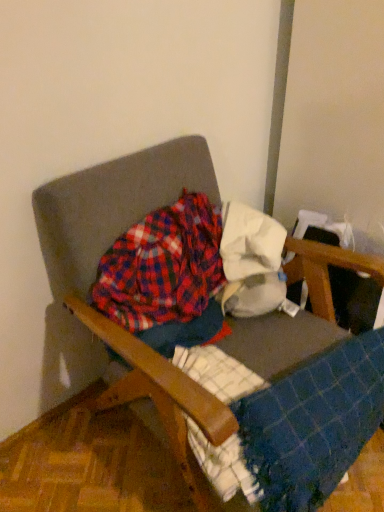
Question: Considering the positions of point (288, 390) and point (274, 227), is point (288, 390) closer or farther from the camera than point (274, 227)?

Choices:
 (A) farther
 (B) closer

Answer: (B)

Question: From the image's perspective, is blue checkered blanket at lower right located above or below white cotton cloth at upper right?

Choices:
 (A) above
 (B) below

Answer: (B)

Question: Which of these objects is positioned closest to the wooden armchair at center?

Choices:
 (A) blue checkered blanket at lower right
 (B) plaid fabric at center
 (C) white cotton cloth at upper right

Answer: (B)

Question: Which object is positioned closest to the wooden armchair at center?

Choices:
 (A) plaid fabric at center
 (B) white cotton cloth at upper right
 (C) blue checkered blanket at lower right

Answer: (A)